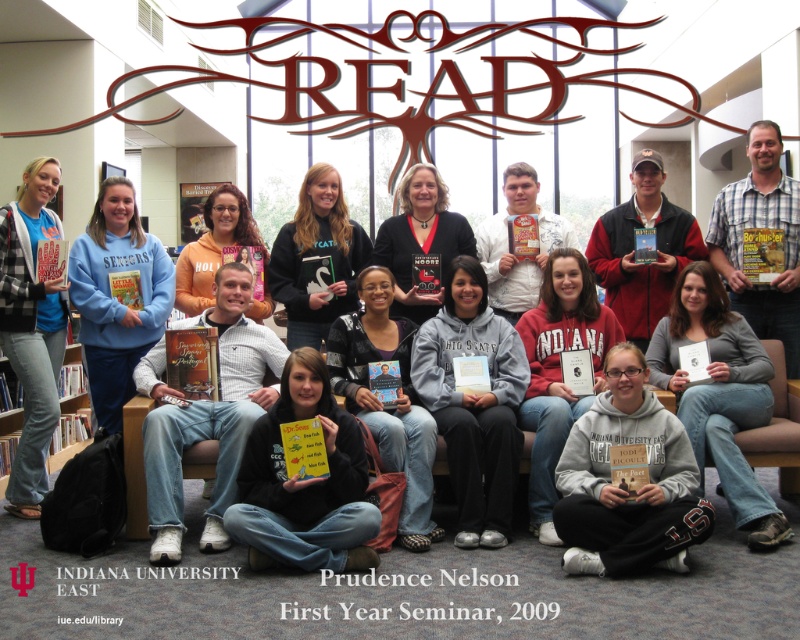
Question: Does gray fleece sweatshirt at lower center have a greater width compared to gray fleece hoodie at center?

Choices:
 (A) no
 (B) yes

Answer: (A)

Question: Does matte blue hoodie at upper left have a greater width compared to black matte sweatshirt at center?

Choices:
 (A) yes
 (B) no

Answer: (B)

Question: Considering the relative positions of white striped shirt at center and matte blue hoodie at upper left in the image provided, where is white striped shirt at center located with respect to matte blue hoodie at upper left?

Choices:
 (A) left
 (B) right

Answer: (B)

Question: Based on their relative distances, which object is nearer to the matte black hoodie at center?

Choices:
 (A) gray fleece sweatshirt at lower center
 (B) matte blue hoodie at upper left
 (C) white striped shirt at center

Answer: (C)

Question: Which point is farther from the camera taking this photo?

Choices:
 (A) (433, 352)
 (B) (458, 248)
 (C) (322, 316)
 (D) (534, 410)

Answer: (B)

Question: Which point appears farthest from the camera in this image?

Choices:
 (A) (656, 497)
 (B) (328, 189)
 (C) (329, 330)
 (D) (250, 518)

Answer: (B)